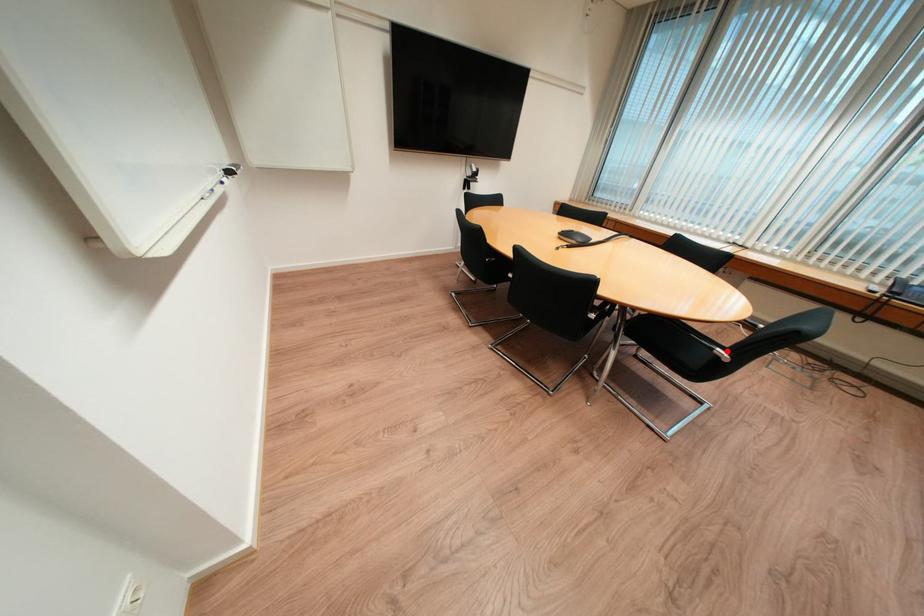
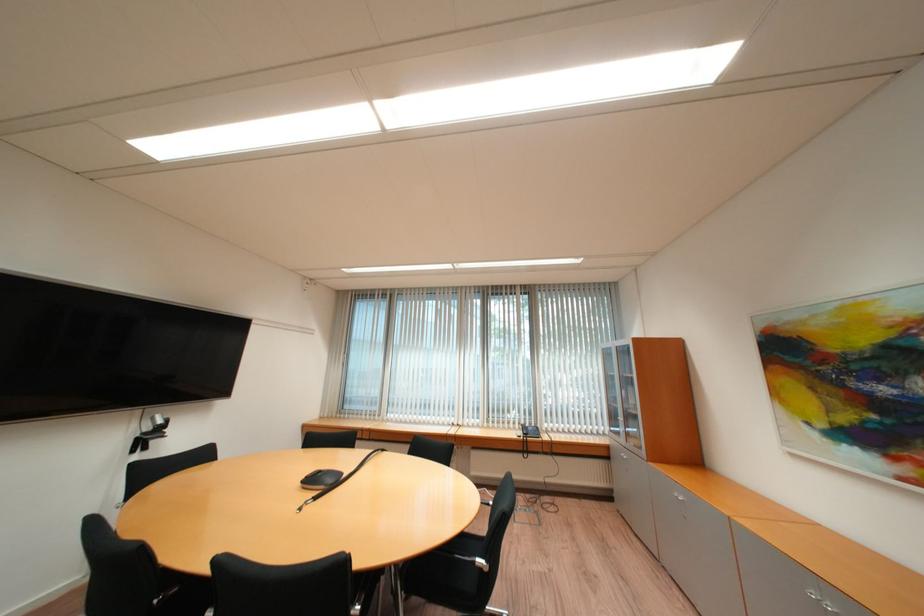
Question: I am providing you with two images of the same scene from different viewpoints. In image1, a red point is highlighted. Considering the same 3D point in image2, which of the following is correct?

Choices:
 (A) It is closer
 (B) It is farther

Answer: (A)